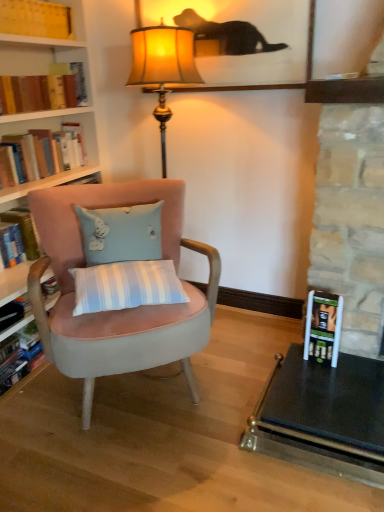
Describe the element at coordinates (36, 19) in the screenshot. I see `yellow paper book at upper left, which ranks as the first book in top-to-bottom order` at that location.

This screenshot has height=512, width=384. I want to click on hardcover books at left, the 3th book from the bottom, so click(x=46, y=151).

You are a GUI agent. You are given a task and a screenshot of the screen. Output one action in this format:
    pyautogui.click(x=<x>, y=<y>)
    Task: Click on the hardcover book at left, marked as the 5th book in a top-to-bottom arrangement
    The image size is (384, 512).
    Given the screenshot: What is the action you would take?
    pyautogui.click(x=22, y=358)

This screenshot has width=384, height=512. I want to click on hardcover book at left, which ranks as the 4th book in bottom-to-top order, so (x=39, y=92).

From the image's perspective, which one is positioned lower, hardcover books at left, the 3th book from the bottom, or hardcover book at left, the 4th book viewed from the top?

hardcover book at left, the 4th book viewed from the top, from the image's perspective.

Considering the positions of points (21, 149) and (30, 223), is point (21, 149) farther from camera compared to point (30, 223)?

That is False.

From the picture: Is hardcover books at left, the 3th book from the bottom, not inside hardcover book at left, arranged as the second book when ordered from the bottom?

hardcover books at left, the 3th book from the bottom, lies outside hardcover book at left, arranged as the second book when ordered from the bottom,'s area.

Does hardcover books at left, the 3th book from the bottom, appear on the left side of hardcover book at left, arranged as the second book when ordered from the bottom?

In fact, hardcover books at left, the 3th book from the bottom, is to the right of hardcover book at left, arranged as the second book when ordered from the bottom.

From a real-world perspective, who is located higher, hardcover book at left, arranged as the second book when ordered from the bottom, or hardcover books at left, positioned as the third book in top-to-bottom order?

hardcover books at left, positioned as the third book in top-to-bottom order.

Starting from the hardcover books at left, positioned as the third book in top-to-bottom order, which book is the 2nd one behind? Please provide its 2D coordinates.

[(25, 231)]

Can you tell me how much hardcover book at left, the 4th book viewed from the top, and hardcover books at left, the 3th book from the bottom, differ in facing direction?

0.599 degrees.

Considering the sizes of hardcover book at left, the 4th book viewed from the top, and hardcover books at left, positioned as the third book in top-to-bottom order, in the image, is hardcover book at left, the 4th book viewed from the top, taller or shorter than hardcover books at left, positioned as the third book in top-to-bottom order,?

In the image, hardcover book at left, the 4th book viewed from the top, appears to be shorter than hardcover books at left, positioned as the third book in top-to-bottom order.

Does hardcover book at left, marked as the 5th book in a top-to-bottom arrangement, contain yellow paper book at upper left, the fifth book in the bottom-to-top sequence?

Definitely not — yellow paper book at upper left, the fifth book in the bottom-to-top sequence, is not inside hardcover book at left, marked as the 5th book in a top-to-bottom arrangement.

Does point (36, 328) come closer to viewer compared to point (40, 17)?

No, (36, 328) is behind (40, 17).

Is hardcover book at left, which is counted as the first book, starting from the bottom, positioned far away from yellow paper book at upper left, the fifth book in the bottom-to-top sequence?

That's right, there is a large distance between hardcover book at left, which is counted as the first book, starting from the bottom, and yellow paper book at upper left, the fifth book in the bottom-to-top sequence.

Is velvet pink chair at center wider than hardcover book at lower right?

Correct, the width of velvet pink chair at center exceeds that of hardcover book at lower right.

I want to click on chair that appears in front of the hardcover book at lower right, so click(120, 310).

From a real-world perspective, is velvet pink chair at center on top of hardcover book at lower right?

Correct, in the physical world, velvet pink chair at center is higher than hardcover book at lower right.

Could hardcover book at lower right be considered to be inside velvet pink chair at center?

No, hardcover book at lower right is located outside of velvet pink chair at center.

Based on the photo, can you confirm if hardcover book at left, which is counted as the first book, starting from the bottom, is thinner than velvet pink chair at center?

Correct, the width of hardcover book at left, which is counted as the first book, starting from the bottom, is less than that of velvet pink chair at center.

Which is farther from the camera, [23,341] or [69,298]?

Positioned behind is point [23,341].

Is hardcover book at left, marked as the 5th book in a top-to-bottom arrangement, shorter than velvet pink chair at center?

Correct, hardcover book at left, marked as the 5th book in a top-to-bottom arrangement, is not as tall as velvet pink chair at center.

Which object is positioned more to the right, hardcover book at left, which is counted as the first book, starting from the bottom, or velvet pink chair at center?

velvet pink chair at center is more to the right.

Would you say hardcover books at left, the 3th book from the bottom, is outside yellow paper book at upper left, which ranks as the first book in top-to-bottom order?

Yes, hardcover books at left, the 3th book from the bottom, is outside of yellow paper book at upper left, which ranks as the first book in top-to-bottom order.

From a real-world perspective, between hardcover books at left, the 3th book from the bottom, and yellow paper book at upper left, which ranks as the first book in top-to-bottom order, who is vertically higher?

yellow paper book at upper left, which ranks as the first book in top-to-bottom order, from a real-world perspective.

Is hardcover books at left, the 3th book from the bottom, oriented away from yellow paper book at upper left, the fifth book in the bottom-to-top sequence?

No, yellow paper book at upper left, the fifth book in the bottom-to-top sequence, is not at the back of hardcover books at left, the 3th book from the bottom.

Between hardcover book at left, the second book positioned from the top, and velvet pink chair at center, which one is positioned in front?

velvet pink chair at center.

Looking at their sizes, would you say hardcover book at left, which ranks as the 4th book in bottom-to-top order, is wider or thinner than velvet pink chair at center?

Considering their sizes, hardcover book at left, which ranks as the 4th book in bottom-to-top order, looks slimmer than velvet pink chair at center.

From the image's perspective, relative to velvet pink chair at center, is hardcover book at left, which ranks as the 4th book in bottom-to-top order, above or below?

Based on their image positions, hardcover book at left, which ranks as the 4th book in bottom-to-top order, is located above velvet pink chair at center.

From a real-world perspective, is hardcover book at left, the second book positioned from the top, physically located above or below velvet pink chair at center?

In terms of real-world spatial position, hardcover book at left, the second book positioned from the top, is above velvet pink chair at center.

Locate an element on the screen. the 1st book below the hardcover books at left, positioned as the third book in top-to-bottom order (from a real-world perspective) is located at coordinates (25, 231).

Where is `the 1st book above the hardcover book at left, the 4th book viewed from the top (from the image's perspective)`? The image size is (384, 512). the 1st book above the hardcover book at left, the 4th book viewed from the top (from the image's perspective) is located at coordinates (46, 151).

Considering their positions, is velvet pink chair at center positioned closer to hardcover book at left, the 4th book viewed from the top, than yellow paper book at upper left, the fifth book in the bottom-to-top sequence?

velvet pink chair at center.

Estimate the real-world distances between objects in this image. Which object is closer to hardcover book at lower right, hardcover book at left, the second book positioned from the top, or hardcover book at left, which is counted as the first book, starting from the bottom?

hardcover book at left, which is counted as the first book, starting from the bottom, lies closer to hardcover book at lower right than the other object.

Based on their spatial positions, is hardcover book at left, which is counted as the first book, starting from the bottom, or velvet pink chair at center closer to hardcover book at lower right?

Based on the image, velvet pink chair at center appears to be nearer to hardcover book at lower right.

Based on their spatial positions, is hardcover book at left, which ranks as the 4th book in bottom-to-top order, or velvet pink chair at center further from hardcover book at lower right?

The object further to hardcover book at lower right is hardcover book at left, which ranks as the 4th book in bottom-to-top order.

Considering their positions, is velvet pink chair at center positioned closer to hardcover book at left, which is counted as the first book, starting from the bottom, than hardcover book at left, the 4th book viewed from the top?

hardcover book at left, the 4th book viewed from the top, is closer to hardcover book at left, which is counted as the first book, starting from the bottom.

When comparing their distances from hardcover books at left, positioned as the third book in top-to-bottom order, does hardcover book at lower right or hardcover book at left, arranged as the second book when ordered from the bottom, seem further?

Based on the image, hardcover book at lower right appears to be further to hardcover books at left, positioned as the third book in top-to-bottom order.

From the image, which object appears to be farther from hardcover book at left, the second book positioned from the top, hardcover books at left, positioned as the third book in top-to-bottom order, or velvet pink chair at center?

velvet pink chair at center.

From the image, which object appears to be farther from hardcover book at left, marked as the 5th book in a top-to-bottom arrangement, hardcover book at left, which ranks as the 4th book in bottom-to-top order, or hardcover book at left, the 4th book viewed from the top?

Among the two, hardcover book at left, which ranks as the 4th book in bottom-to-top order, is located further to hardcover book at left, marked as the 5th book in a top-to-bottom arrangement.

Where is `book that lies between hardcover book at left, which ranks as the 4th book in bottom-to-top order, and hardcover book at left, arranged as the second book when ordered from the bottom, from top to bottom`? book that lies between hardcover book at left, which ranks as the 4th book in bottom-to-top order, and hardcover book at left, arranged as the second book when ordered from the bottom, from top to bottom is located at coordinates (46, 151).

Locate an element on the screen. The height and width of the screenshot is (512, 384). chair between hardcover book at left, which ranks as the 4th book in bottom-to-top order, and hardcover book at left, marked as the 5th book in a top-to-bottom arrangement, vertically is located at coordinates (120, 310).

Identify the location of chair between hardcover book at left, the second book positioned from the top, and hardcover book at lower right. Image resolution: width=384 pixels, height=512 pixels. (120, 310).

Find the location of a particular element. chair between hardcover books at left, positioned as the third book in top-to-bottom order, and hardcover book at left, which is counted as the first book, starting from the bottom, vertically is located at coordinates (120, 310).